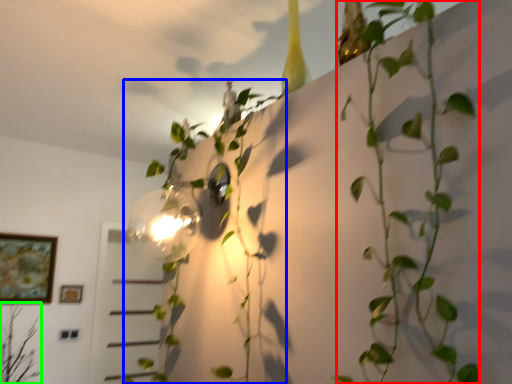
Question: Which object is positioned farthest from plant (highlighted by a red box)? Select from plant (highlighted by a blue box) and plant (highlighted by a green box).

Choices:
 (A) plant
 (B) plant

Answer: (B)